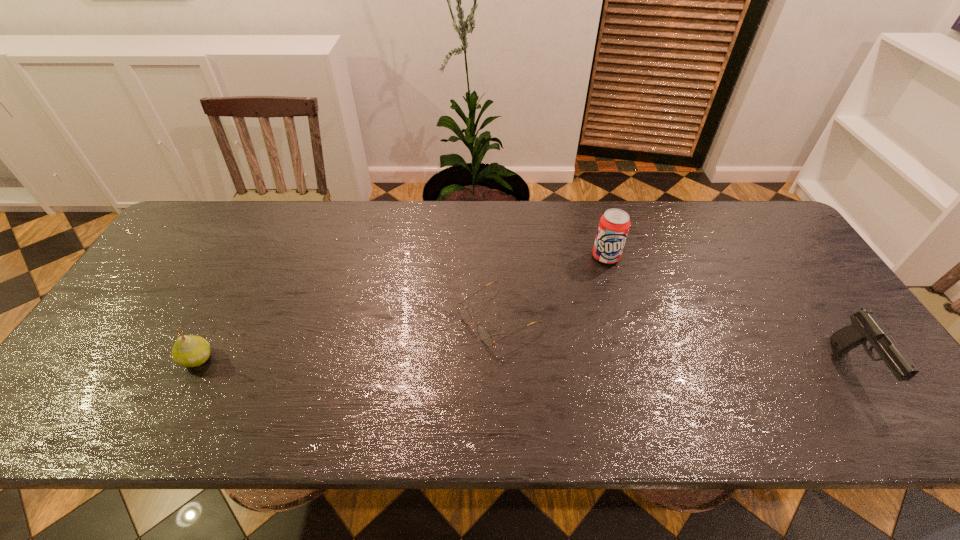
Locate an element on the screen. free spot between the tallest object and the rightmost object is located at coordinates point(731,312).

Find the location of a particular element. The image size is (960, 540). vacant point located between the pear and the third object from left to right is located at coordinates (401, 308).

Identify the location of empty location between the farthest object and the leftmost object. (401, 308).

Identify the location of vacant space in between the shortest object and the leftmost object. This screenshot has width=960, height=540. (348, 338).

Identify the location of vacant area that lies between the rightmost object and the spectacles. The height and width of the screenshot is (540, 960). (677, 342).

Select which object is the third closest to the shortest object. Please provide its 2D coordinates. Your answer should be formatted as a tuple, i.e. [(x, y)], where the tuple contains the x and y coordinates of a point satisfying the conditions above.

[(865, 326)]

You are a GUI agent. You are given a task and a screenshot of the screen. Output one action in this format:
    pyautogui.click(x=<x>, y=<y>)
    Task: Click on the second closest object to the soda can
    
    Given the screenshot: What is the action you would take?
    pyautogui.click(x=865, y=326)